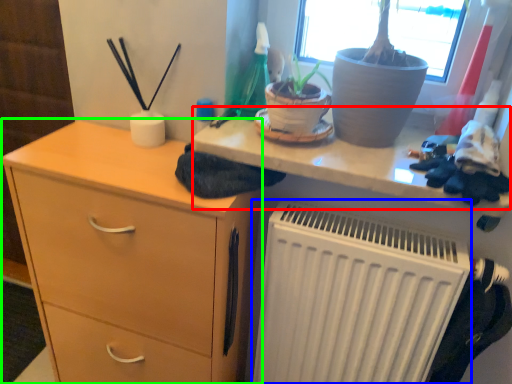
Question: Estimate the real-world distances between objects in this image. Which object is closer to writing desk (highlighted by a red box), radiator (highlighted by a blue box) or chest of drawers (highlighted by a green box)?

Choices:
 (A) radiator
 (B) chest of drawers

Answer: (A)